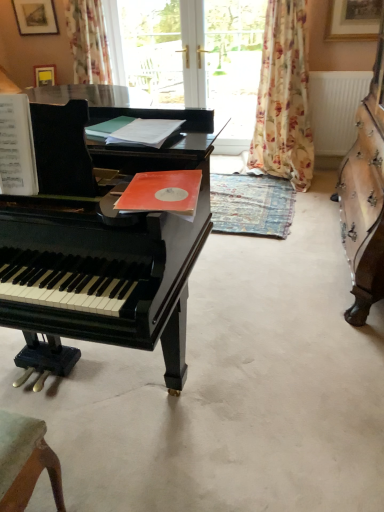
Question: Can you confirm if white plastic radiator at upper right is wider than matte black harpsichord at center?

Choices:
 (A) yes
 (B) no

Answer: (B)

Question: Can you confirm if white plastic radiator at upper right is positioned to the right of matte black harpsichord at center?

Choices:
 (A) yes
 (B) no

Answer: (A)

Question: From a real-world perspective, is white plastic radiator at upper right under matte black harpsichord at center?

Choices:
 (A) yes
 (B) no

Answer: (A)

Question: From the image's perspective, is white plastic radiator at upper right on matte black harpsichord at center?

Choices:
 (A) yes
 (B) no

Answer: (A)

Question: Is the position of white plastic radiator at upper right more distant than that of matte black harpsichord at center?

Choices:
 (A) yes
 (B) no

Answer: (A)

Question: Can you confirm if white plastic radiator at upper right is smaller than matte black harpsichord at center?

Choices:
 (A) no
 (B) yes

Answer: (B)

Question: Is matte black harpsichord at center thinner than black piano at left?

Choices:
 (A) no
 (B) yes

Answer: (B)

Question: Does matte black harpsichord at center have a smaller size compared to black piano at left?

Choices:
 (A) no
 (B) yes

Answer: (A)

Question: Can you confirm if matte black harpsichord at center is shorter than black piano at left?

Choices:
 (A) no
 (B) yes

Answer: (A)

Question: From the image's perspective, does matte black harpsichord at center appear lower than black piano at left?

Choices:
 (A) no
 (B) yes

Answer: (A)

Question: Does matte black harpsichord at center have a larger size compared to black piano at left?

Choices:
 (A) no
 (B) yes

Answer: (B)

Question: Is black piano at left a part of matte black harpsichord at center?

Choices:
 (A) no
 (B) yes

Answer: (A)

Question: Is transparent glass door at upper center, which is the first window screen in left-to-right order, looking in the opposite direction of transparent glass door at center, marked as the 1th window screen in a right-to-left arrangement?

Choices:
 (A) no
 (B) yes

Answer: (A)